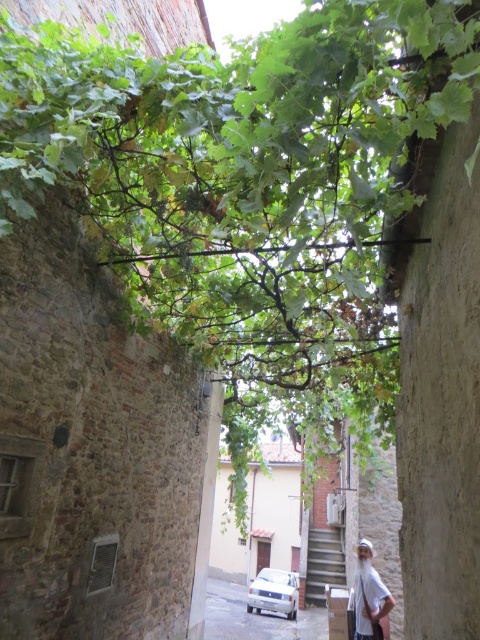
Question: Estimate the real-world distances between objects in this image. Which object is closer to the white matte car at lower center?

Choices:
 (A) dark gray concrete stairs at center
 (B) white cotton shirt at lower right
 (C) white matte car at center

Answer: (C)

Question: Which point is farther from the camera taking this photo?

Choices:
 (A) (298, 596)
 (B) (337, 545)
 (C) (356, 611)
 (D) (286, 636)

Answer: (B)

Question: Where is white matte car at lower center located in relation to dark gray concrete stairs at center in the image?

Choices:
 (A) right
 (B) left

Answer: (B)

Question: Does white cotton shirt at lower right appear under white matte car at center?

Choices:
 (A) yes
 (B) no

Answer: (B)

Question: Considering the relative positions of white matte car at lower center and dark gray concrete stairs at center in the image provided, where is white matte car at lower center located with respect to dark gray concrete stairs at center?

Choices:
 (A) below
 (B) above

Answer: (A)

Question: Estimate the real-world distances between objects in this image. Which object is farther from the dark gray concrete stairs at center?

Choices:
 (A) white matte car at lower center
 (B) white cotton shirt at lower right

Answer: (B)